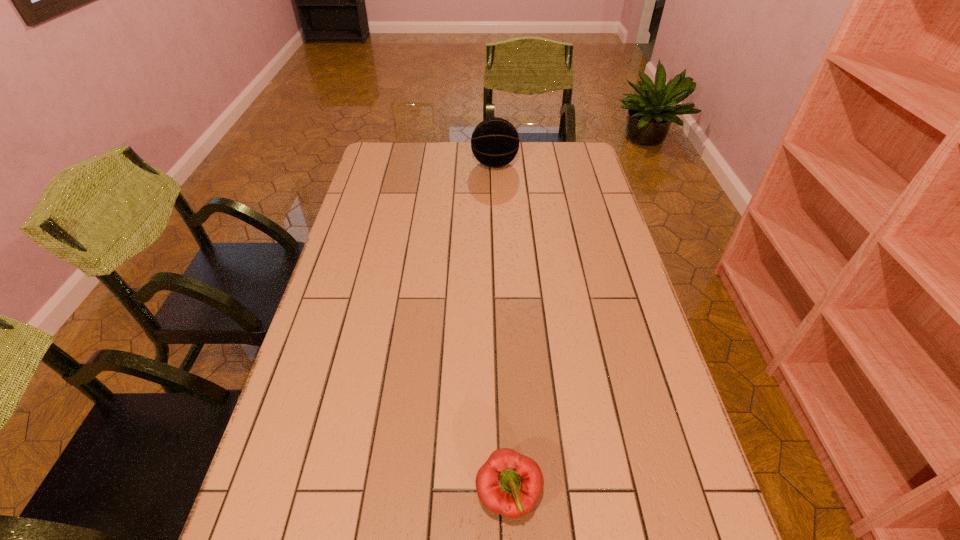
Identify the location of vacant area at the far right corner of the desktop. The image size is (960, 540). (553, 153).

At what (x,y) coordinates should I click in order to perform the action: click on free space in the image that satisfies the following two spatial constraints: 1. on the back side of the basketball; 2. on the left side of the shorter object. Please return your answer as a coordinate pair (x, y). The width and height of the screenshot is (960, 540). Looking at the image, I should click on (493, 164).